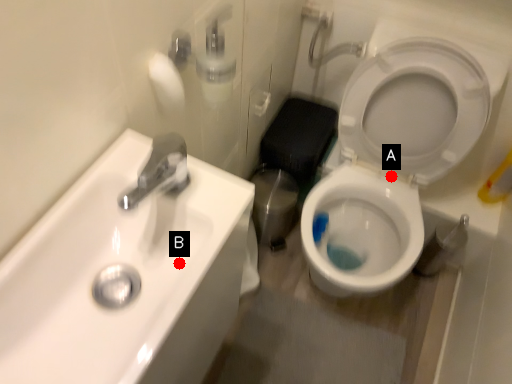
Question: Two points are circled on the image, labeled by A and B beside each circle. Which point appears closest to the camera in this image?

Choices:
 (A) A is closer
 (B) B is closer

Answer: (B)